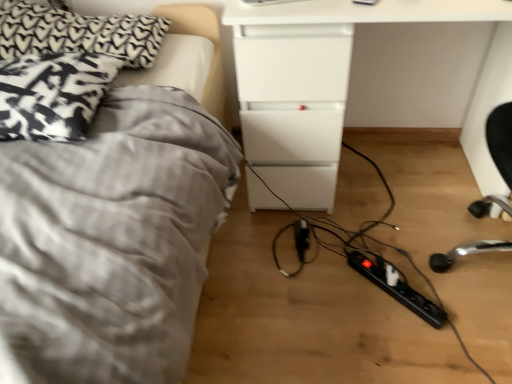
Question: Should I look upward or downward to see black plastic extension cord at lower right, the first extension cord when ordered from bottom to top?

Choices:
 (A) up
 (B) down

Answer: (B)

Question: From the image's perspective, is gray fabric bed at left beneath black plastic extension cord at center, acting as the 1th extension cord starting from the left?

Choices:
 (A) yes
 (B) no

Answer: (B)

Question: Is gray fabric bed at left positioned beyond the bounds of black plastic extension cord at center, the second extension cord from the bottom?

Choices:
 (A) yes
 (B) no

Answer: (A)

Question: Could you tell me if gray fabric bed at left is facing black plastic extension cord at center, the second extension cord viewed from the front?

Choices:
 (A) no
 (B) yes

Answer: (A)

Question: From a real-world perspective, does gray fabric bed at left sit lower than black plastic extension cord at center, the second extension cord from the bottom?

Choices:
 (A) no
 (B) yes

Answer: (A)

Question: From a real-world perspective, is gray fabric bed at left positioned over black plastic extension cord at center, the second extension cord viewed from the front, based on gravity?

Choices:
 (A) no
 (B) yes

Answer: (B)

Question: Is gray fabric bed at left not near black plastic extension cord at center, the second extension cord viewed from the front?

Choices:
 (A) yes
 (B) no

Answer: (B)

Question: From a real-world perspective, is black plastic extension cord at center, which appears as the 2th extension cord when viewed from the right, located higher than black plastic extension cord at lower right, the first extension cord from the front?

Choices:
 (A) yes
 (B) no

Answer: (B)

Question: Is black plastic extension cord at center, acting as the 1th extension cord starting from the left, shorter than black plastic extension cord at lower right, the 2th extension cord when ordered from back to front?

Choices:
 (A) no
 (B) yes

Answer: (B)

Question: Is black plastic extension cord at center, which is the first extension cord in top-to-bottom order, smaller than black plastic extension cord at lower right, the first extension cord when ordered from bottom to top?

Choices:
 (A) yes
 (B) no

Answer: (A)

Question: Is black plastic extension cord at center, the second extension cord viewed from the front, thinner than black plastic extension cord at lower right, the first extension cord from the front?

Choices:
 (A) no
 (B) yes

Answer: (B)

Question: Is black plastic extension cord at center, acting as the 1th extension cord starting from the left, wider than black plastic extension cord at lower right, the first extension cord positioned from the right?

Choices:
 (A) yes
 (B) no

Answer: (B)

Question: Does black plastic extension cord at center, the 1th extension cord from the back, have a larger size compared to black plastic extension cord at lower right, the first extension cord from the front?

Choices:
 (A) no
 (B) yes

Answer: (A)

Question: Is black plastic extension cord at lower right, the first extension cord positioned from the right, inside black textured pillow at upper left, the second pillow positioned from the bottom?

Choices:
 (A) yes
 (B) no

Answer: (B)